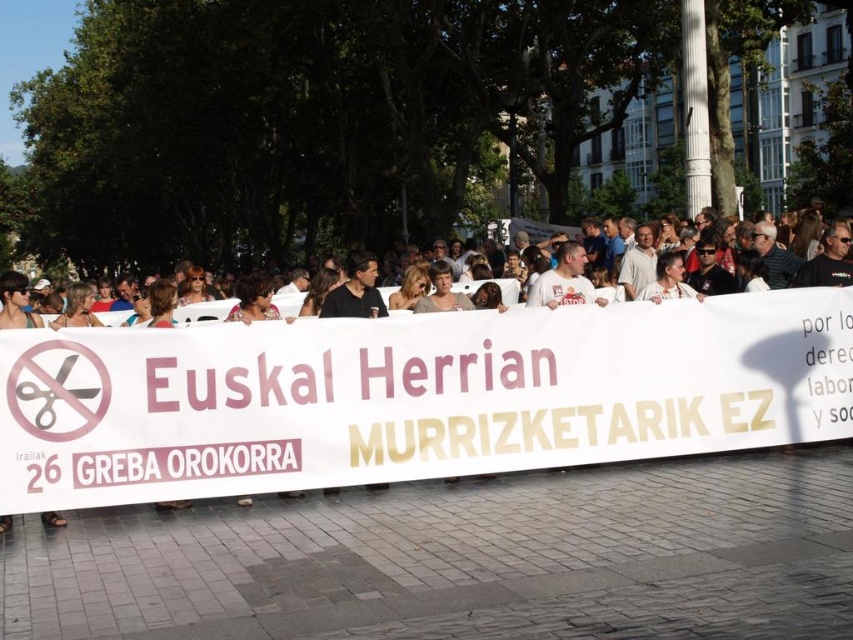
Does white paper banner at center have a greater width compared to white cloth banner at center?

No, white paper banner at center is not wider than white cloth banner at center.

Is the position of white paper banner at center more distant than that of white cloth banner at center?

No, it is in front of white cloth banner at center.

Locate an element on the screen. The width and height of the screenshot is (853, 640). white paper banner at center is located at coordinates (412, 396).